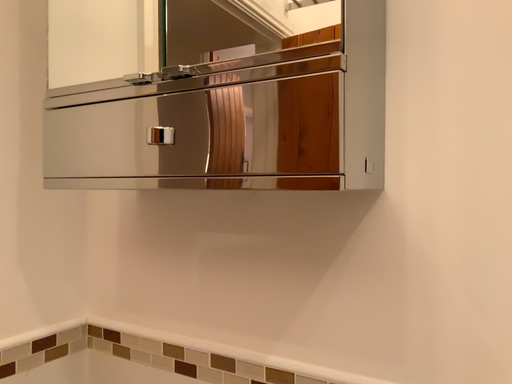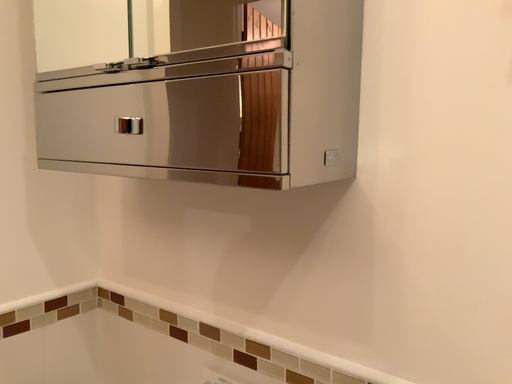
Question: Which way did the camera rotate in the video?

Choices:
 (A) rotated left
 (B) rotated right

Answer: (A)